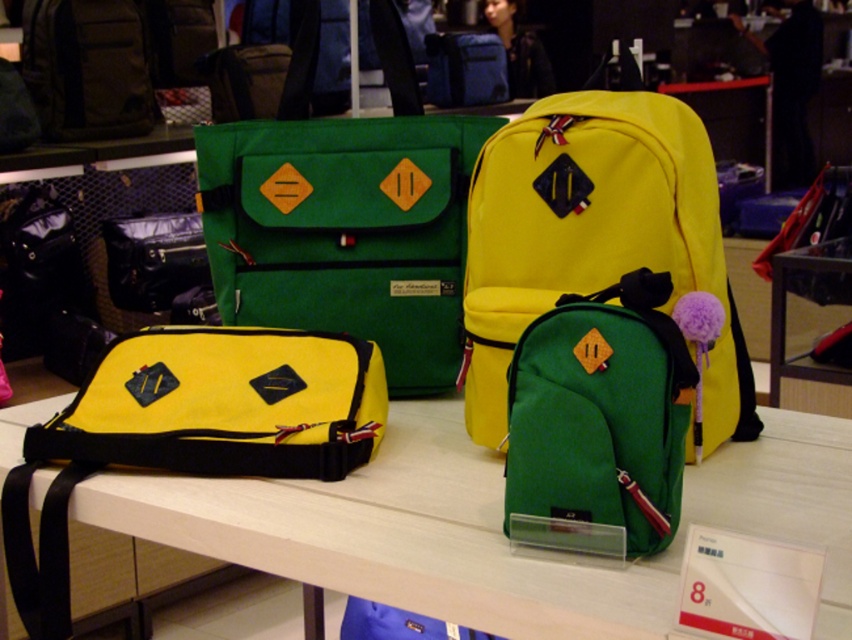
Can you confirm if matte green backpack at center is taller than matte black camera at center?

Incorrect, matte green backpack at center's height is not larger of matte black camera at center's.

Is point (580, 324) in front of point (140, 227)?

Yes, it is in front of point (140, 227).

The height and width of the screenshot is (640, 852). Identify the location of matte green backpack at center. (602, 412).

Can you confirm if green felt backpack at center is smaller than matte black camera at center?

No.

Is green felt backpack at center thinner than matte black camera at center?

In fact, green felt backpack at center might be wider than matte black camera at center.

Image resolution: width=852 pixels, height=640 pixels. Identify the location of green felt backpack at center. (594, 240).

Is yellow fabric duffel at center positioned in front of matte black backpack at upper left?

Yes, yellow fabric duffel at center is in front of matte black backpack at upper left.

Measure the distance between yellow fabric duffel at center and matte black backpack at upper left.

yellow fabric duffel at center is 5.94 feet from matte black backpack at upper left.

Identify the location of yellow fabric duffel at center. (190, 429).

Identify the location of yellow fabric duffel at center. (190, 429).